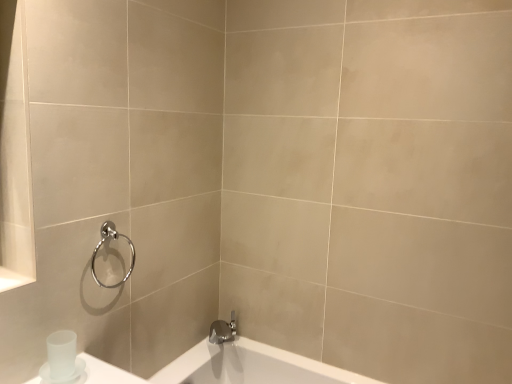
What do you see at coordinates (223, 330) in the screenshot?
I see `satin nickel faucet at lower center` at bounding box center [223, 330].

What is the approximate width of polished chrome towel ring at upper left?

It is 1.66 inches.

What is the approximate height of satin white cup at lower left?

It is 4.72 inches.

Describe the element at coordinates (78, 364) in the screenshot. This screenshot has width=512, height=384. I see `satin white cup at lower left` at that location.

Image resolution: width=512 pixels, height=384 pixels. I want to click on satin nickel faucet at lower center, so click(223, 330).

Consider the image. Considering the sizes of objects polished chrome towel ring at upper left and satin white cup at lower left in the image provided, who is shorter, polished chrome towel ring at upper left or satin white cup at lower left?

satin white cup at lower left is shorter.

Is polished chrome towel ring at upper left aimed at satin white cup at lower left?

No, polished chrome towel ring at upper left does not turn towards satin white cup at lower left.

From a real-world perspective, who is located higher, polished chrome towel ring at upper left or satin white cup at lower left?

In real-world perspective, polished chrome towel ring at upper left is above.

How different are the orientations of polished chrome towel ring at upper left and satin white cup at lower left in degrees?

The angle between the facing direction of polished chrome towel ring at upper left and the facing direction of satin white cup at lower left is 0.673 degrees.

Is satin nickel faucet at lower center positioned behind satin white cup at lower left?

Yes, satin nickel faucet at lower center is further from the viewer.

Does satin nickel faucet at lower center have a smaller size compared to satin white cup at lower left?

No, satin nickel faucet at lower center is not smaller than satin white cup at lower left.

Is satin nickel faucet at lower center oriented away from satin white cup at lower left?

No, satin nickel faucet at lower center's orientation is not away from satin white cup at lower left.

The width and height of the screenshot is (512, 384). Find the location of `tap behind the satin white cup at lower left`. tap behind the satin white cup at lower left is located at coordinates (223, 330).

Are satin white cup at lower left and polished chrome towel ring at upper left located far from each other?

satin white cup at lower left is near polished chrome towel ring at upper left, not far away.

Where is `sink in front of the polished chrome towel ring at upper left`? The image size is (512, 384). sink in front of the polished chrome towel ring at upper left is located at coordinates (78, 364).

Based on their sizes in the image, would you say satin white cup at lower left is bigger or smaller than polished chrome towel ring at upper left?

Clearly, satin white cup at lower left is smaller in size than polished chrome towel ring at upper left.

Which object is closer to the camera taking this photo, satin white cup at lower left or polished chrome towel ring at upper left?

satin white cup at lower left.

Identify the location of shower above the satin nickel faucet at lower center (from the image's perspective). (103, 243).

Which is more to the right, polished chrome towel ring at upper left or satin nickel faucet at lower center?

Positioned to the right is satin nickel faucet at lower center.

Is polished chrome towel ring at upper left wider or thinner than satin nickel faucet at lower center?

In the image, polished chrome towel ring at upper left appears to be more narrow than satin nickel faucet at lower center.

From the image's perspective, is polished chrome towel ring at upper left positioned above or below satin nickel faucet at lower center?

Clearly, from the image's perspective, polished chrome towel ring at upper left is above satin nickel faucet at lower center.

Based on the photo, is satin nickel faucet at lower center completely or partially inside satin white cup at lower left?

No, satin nickel faucet at lower center is located outside of satin white cup at lower left.

Between satin white cup at lower left and satin nickel faucet at lower center, which one has larger width?

With larger width is satin nickel faucet at lower center.

Looking at this image, is satin white cup at lower left directly adjacent to satin nickel faucet at lower center?

satin white cup at lower left and satin nickel faucet at lower center are not in contact.

Could you tell me if satin white cup at lower left is turned towards satin nickel faucet at lower center?

No, satin white cup at lower left does not turn towards satin nickel faucet at lower center.

Considering the relative sizes of satin nickel faucet at lower center and polished chrome towel ring at upper left in the image provided, is satin nickel faucet at lower center shorter than polished chrome towel ring at upper left?

Correct, satin nickel faucet at lower center is not as tall as polished chrome towel ring at upper left.

Do you think satin nickel faucet at lower center is within polished chrome towel ring at upper left, or outside of it?

satin nickel faucet at lower center is spatially situated outside polished chrome towel ring at upper left.

From the image's perspective, which is above, satin nickel faucet at lower center or polished chrome towel ring at upper left?

From the image's view, polished chrome towel ring at upper left is above.

Is satin nickel faucet at lower center further to the viewer compared to polished chrome towel ring at upper left?

Yes, the depth of satin nickel faucet at lower center is greater than that of polished chrome towel ring at upper left.

Where is `shower behind the satin white cup at lower left`? This screenshot has height=384, width=512. shower behind the satin white cup at lower left is located at coordinates (103, 243).

There is a satin nickel faucet at lower center. Identify the location of sink above it (from a real-world perspective). (78, 364).

Based on their spatial positions, is satin nickel faucet at lower center or satin white cup at lower left closer to polished chrome towel ring at upper left?

satin white cup at lower left lies closer to polished chrome towel ring at upper left than the other object.

From the picture: Which object lies further to the anchor point polished chrome towel ring at upper left, satin white cup at lower left or satin nickel faucet at lower center?

satin nickel faucet at lower center lies further to polished chrome towel ring at upper left than the other object.

Which object lies further to the anchor point satin nickel faucet at lower center, satin white cup at lower left or polished chrome towel ring at upper left?

satin white cup at lower left is further to satin nickel faucet at lower center.

Estimate the real-world distances between objects in this image. Which object is further from satin nickel faucet at lower center, polished chrome towel ring at upper left or satin white cup at lower left?

satin white cup at lower left is further to satin nickel faucet at lower center.

From the image, which object appears to be farther from satin white cup at lower left, satin nickel faucet at lower center or polished chrome towel ring at upper left?

satin nickel faucet at lower center lies further to satin white cup at lower left than the other object.

Looking at the image, which one is located closer to satin white cup at lower left, polished chrome towel ring at upper left or satin nickel faucet at lower center?

The object closer to satin white cup at lower left is polished chrome towel ring at upper left.

Locate an element on the screen. shower located between satin white cup at lower left and satin nickel faucet at lower center in the depth direction is located at coordinates [103, 243].